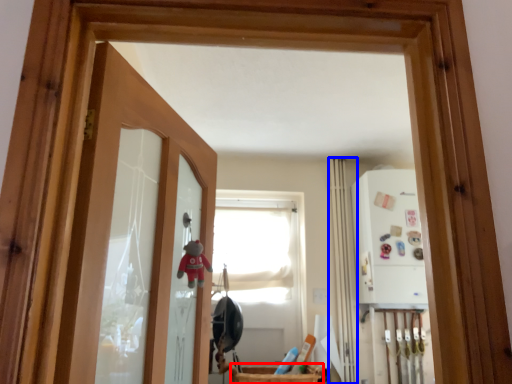
Question: Which object appears closest to the camera in this image, basket (highlighted by a red box) or curtain (highlighted by a blue box)?

Choices:
 (A) basket
 (B) curtain

Answer: (A)